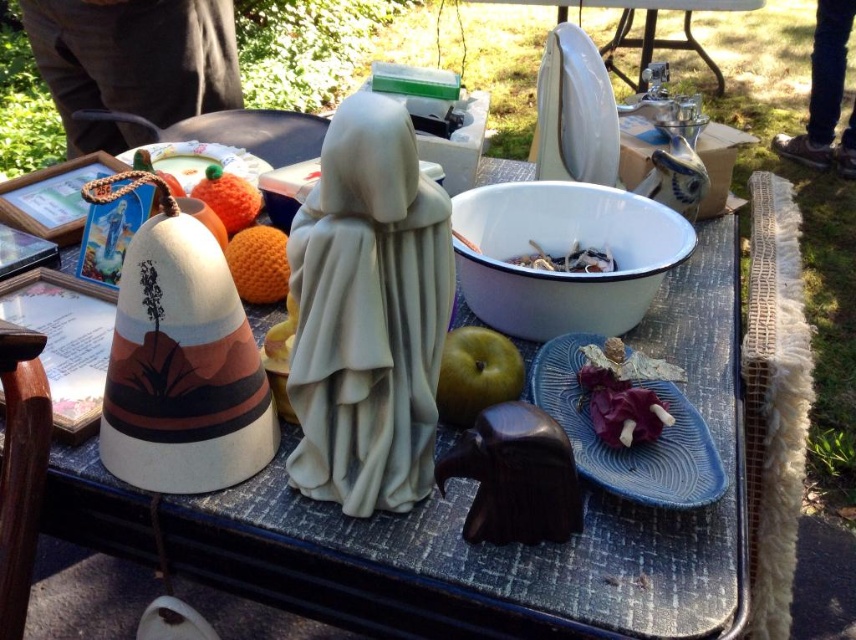
Question: Can you confirm if white fluffy blanket at right is positioned above purple matte fabric at center?

Choices:
 (A) no
 (B) yes

Answer: (A)

Question: Which object is positioned farthest from the green matte apple at center?

Choices:
 (A) white enamel bowl at center
 (B) purple matte fabric at center
 (C) orange fuzzy ball at upper center
 (D) matte blue platter at center right

Answer: (C)

Question: Which point appears farthest from the camera in this image?

Choices:
 (A) (235, 252)
 (B) (651, 401)
 (C) (462, 323)
 (D) (494, 355)

Answer: (C)

Question: Which object is positioned farthest from the dark brown wood bowl at center?

Choices:
 (A) orange fuzzy ball at upper center
 (B) green matte apple at center
 (C) matte ceramic statue at center
 (D) white fluffy blanket at right

Answer: (A)

Question: Is matte blue platter at center right above orange fuzzy ball at center?

Choices:
 (A) yes
 (B) no

Answer: (B)

Question: Does white enamel bowl at center appear on the right side of matte blue platter at center right?

Choices:
 (A) no
 (B) yes

Answer: (A)